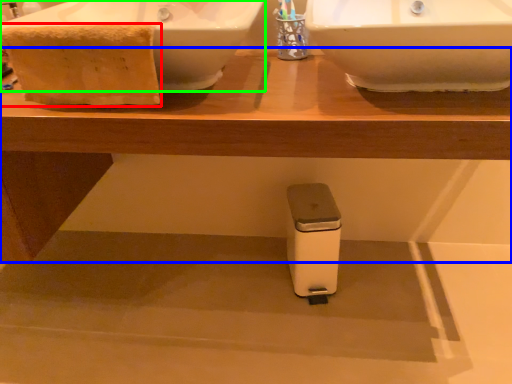
Question: Which is nearer to the material (highlighted by a red box)? table (highlighted by a blue box) or sink (highlighted by a green box).

Choices:
 (A) table
 (B) sink

Answer: (B)